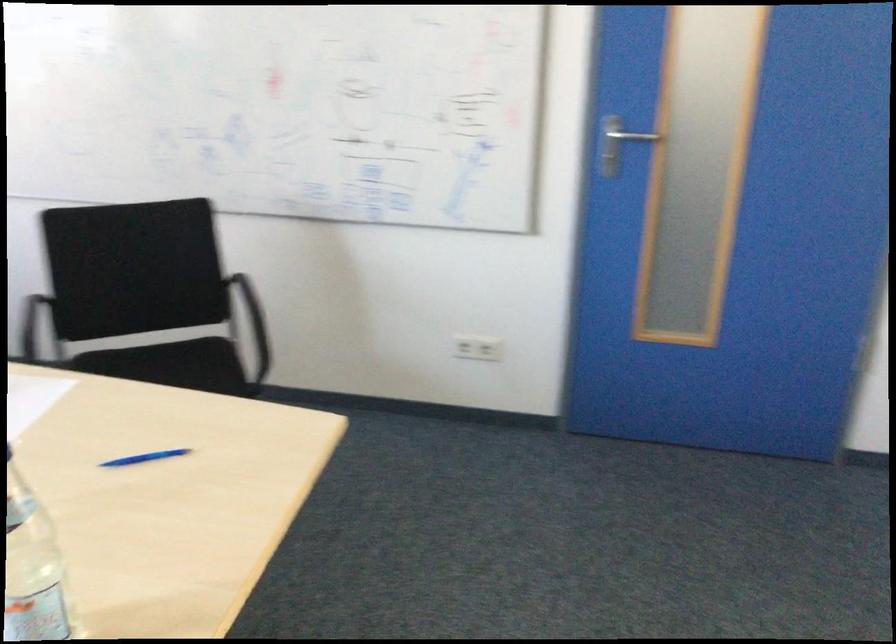
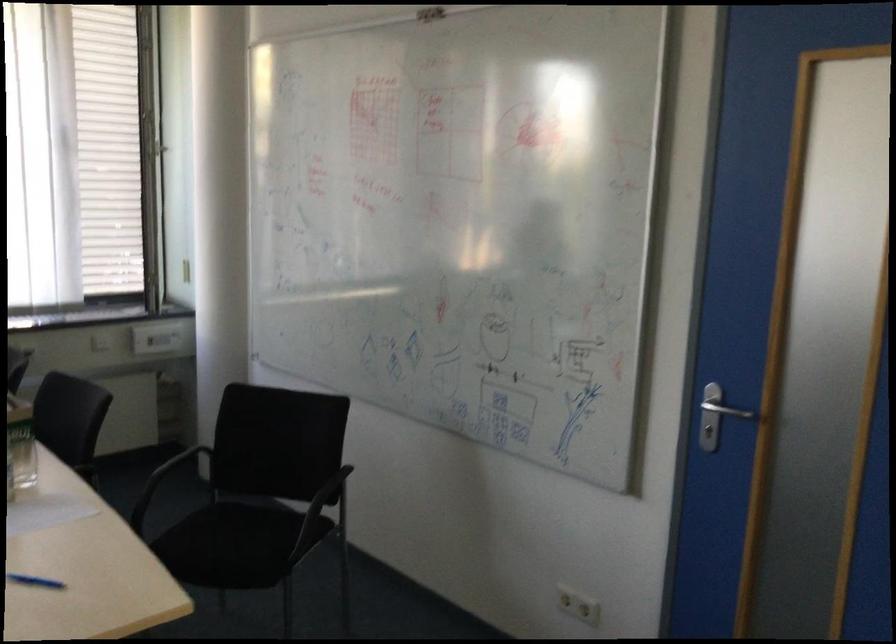
Find the pixel in the second image that matches point (168, 366) in the first image.

(251, 529)